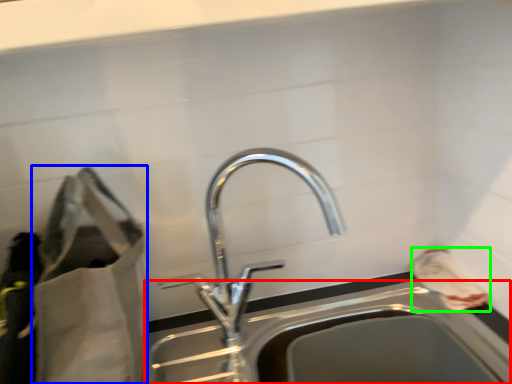
Question: Which object is positioned closest to sink (highlighted by a red box)? Select from bag (highlighted by a blue box) and bag (highlighted by a green box).

Choices:
 (A) bag
 (B) bag

Answer: (B)